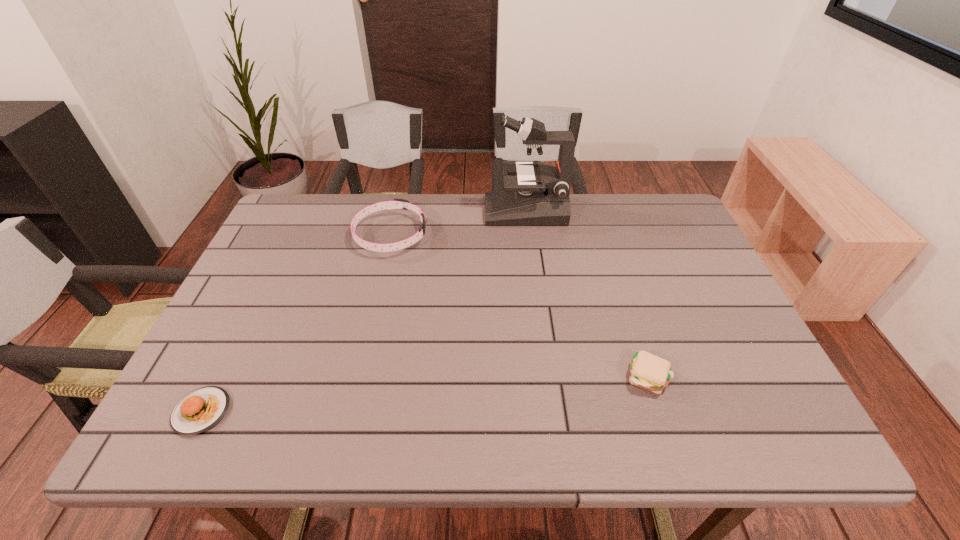
Locate an element on the screen. vacant space that satisfies the following two spatial constraints: 1. with the buckle on the second object from left to right; 2. on the back side of the rightmost object is located at coordinates (358, 377).

Identify the location of vacant space that satisfies the following two spatial constraints: 1. on the back side of the third tallest object; 2. with the buckle on the third object from right to left. The width and height of the screenshot is (960, 540). (602, 235).

Identify the location of vacant area that satisfies the following two spatial constraints: 1. through the eyepieces of the third object from left to right; 2. on the back side of the taller food. (546, 377).